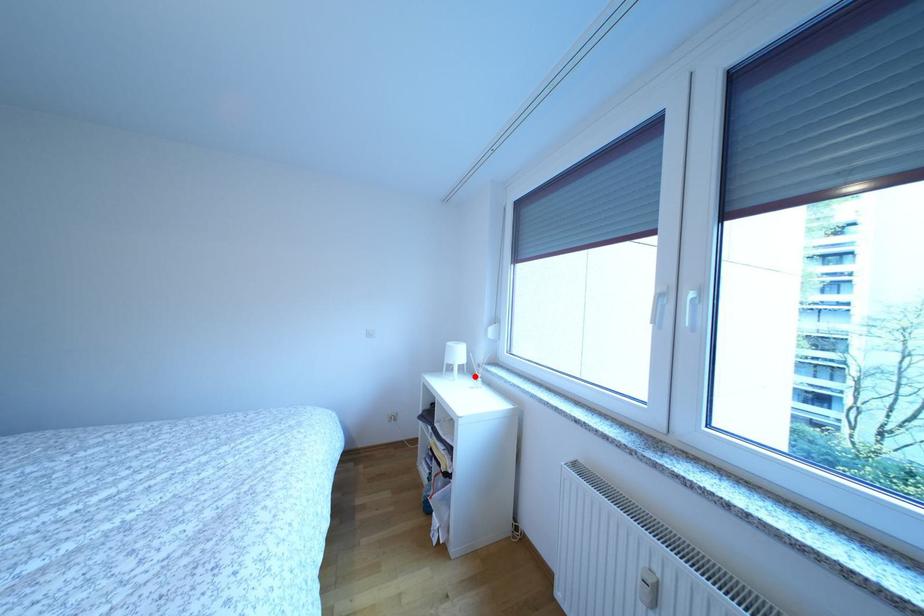
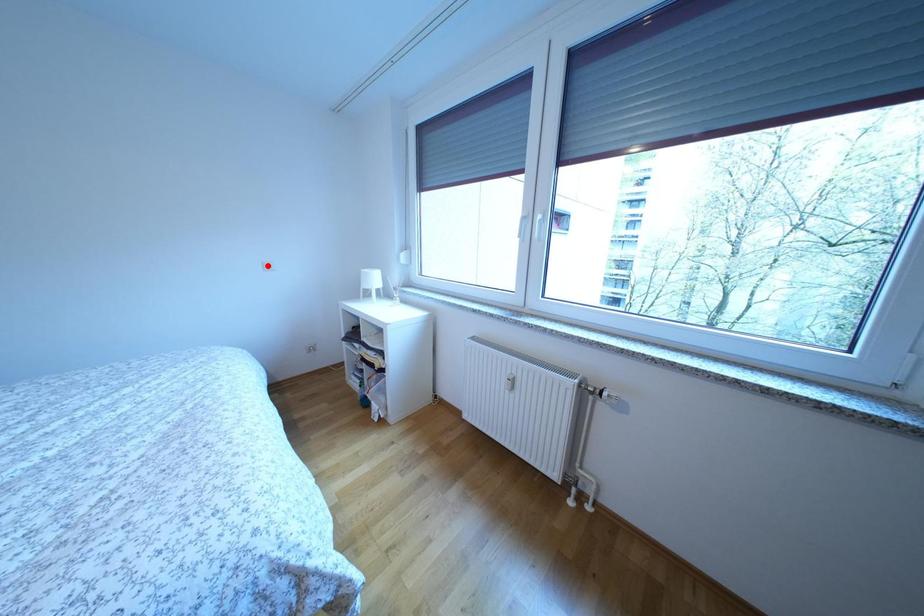
I am providing you with two images of the same scene from different viewpoints. A red point is marked on the first image and another point is marked on the second image. Is the red point in image1 aligned with the point shown in image2?

No